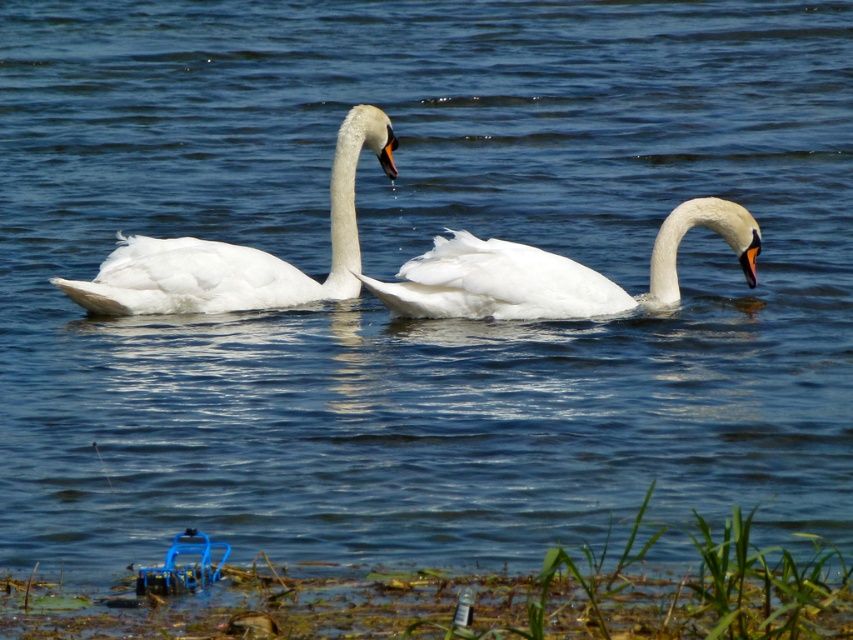
Where is the white glossy swan at center located in the image?

The white glossy swan at center is located at point (238, 252) in the image.